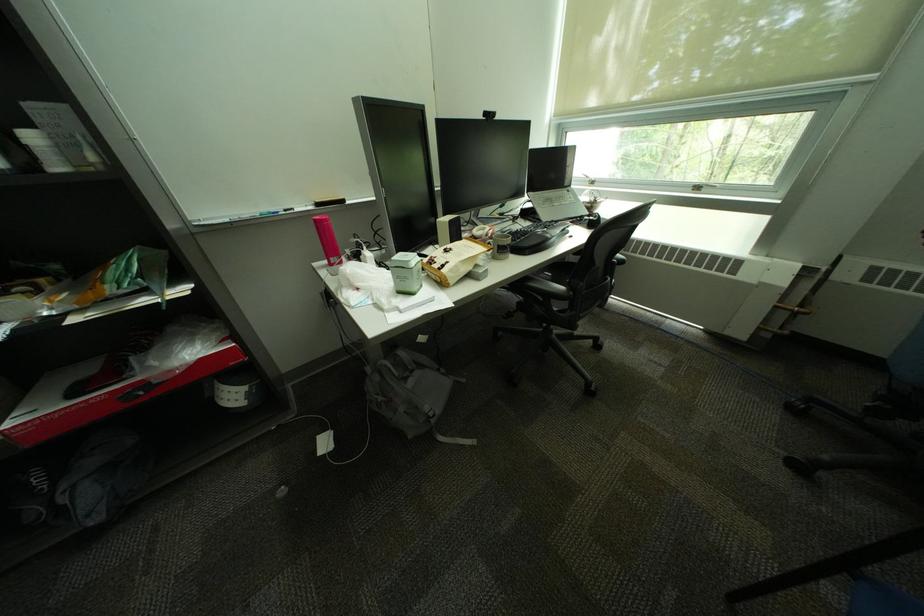
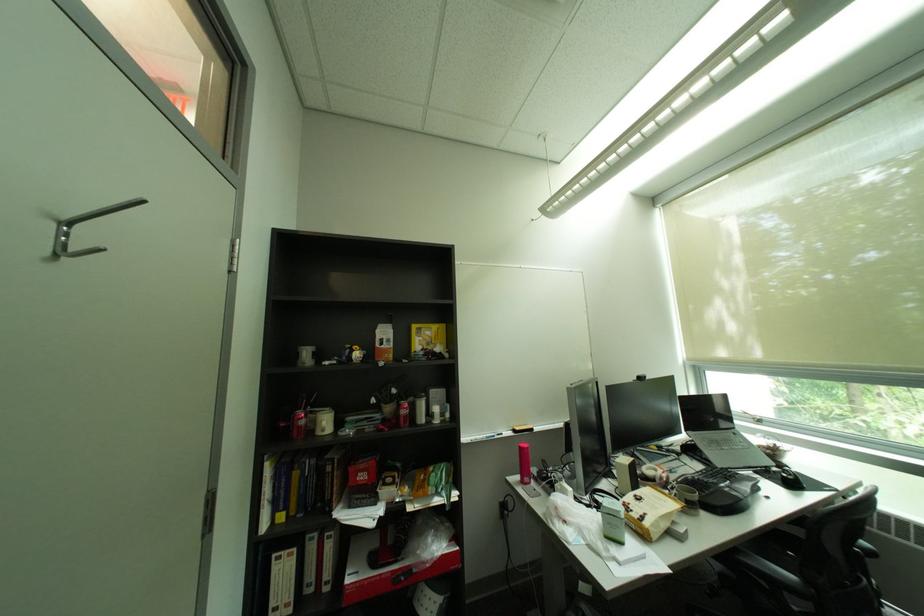
Find the pixel in the second image that matches (x=508, y=246) in the first image.

(697, 500)